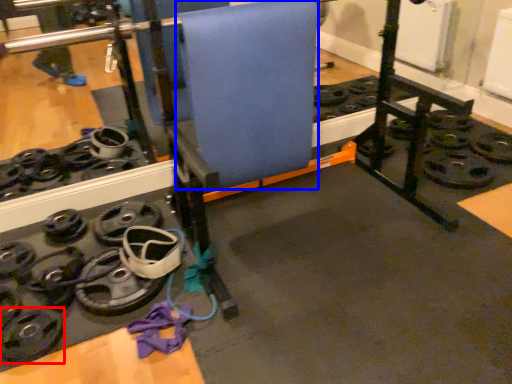
Question: Which object is closer to the camera taking this photo, wheel (highlighted by a red box) or yoga mat (highlighted by a blue box)?

Choices:
 (A) wheel
 (B) yoga mat

Answer: (A)